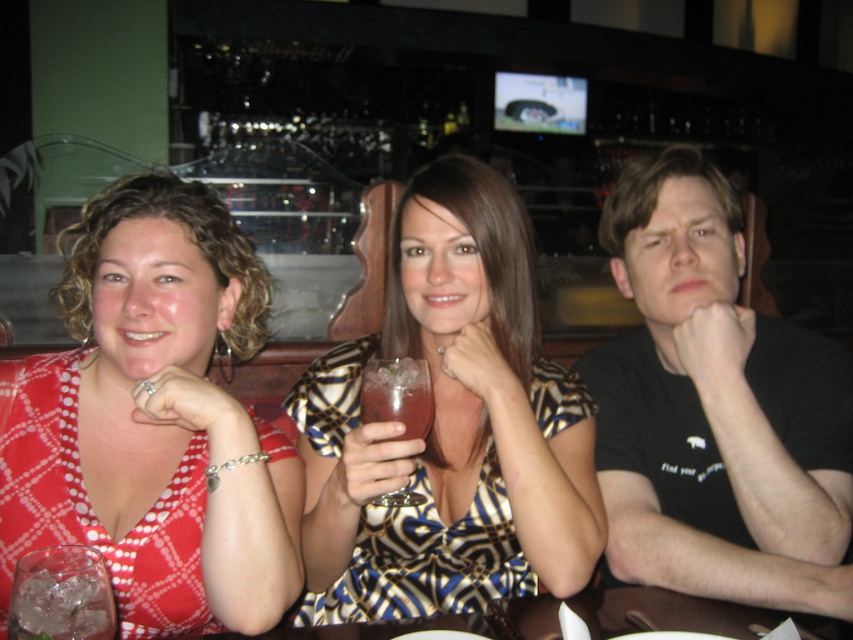
Does printed silk dress at center appear under clear glass ice at lower left?

Actually, printed silk dress at center is above clear glass ice at lower left.

Does printed silk dress at center appear over clear glass ice at lower left?

Yes.

Locate an element on the screen. printed silk dress at center is located at coordinates (450, 426).

You are a GUI agent. You are given a task and a screenshot of the screen. Output one action in this format:
    pyautogui.click(x=<x>, y=<y>)
    Task: Click on the printed silk dress at center
    This screenshot has height=640, width=853.
    Given the screenshot: What is the action you would take?
    pyautogui.click(x=450, y=426)

Does printed silk dress at center have a greater width compared to clear glass at center?

Yes, printed silk dress at center is wider than clear glass at center.

Is printed silk dress at center to the right of clear glass at center from the viewer's perspective?

Indeed, printed silk dress at center is positioned on the right side of clear glass at center.

Find the location of a particular element. Image resolution: width=853 pixels, height=640 pixels. printed silk dress at center is located at coordinates (450, 426).

Does point (257, 337) lie in front of point (577, 368)?

Yes, point (257, 337) is in front of point (577, 368).

Is polka dot fabric dress at left thinner than black cotton t-shirt at center?

Incorrect, polka dot fabric dress at left's width is not less than black cotton t-shirt at center's.

Locate an element on the screen. polka dot fabric dress at left is located at coordinates (154, 420).